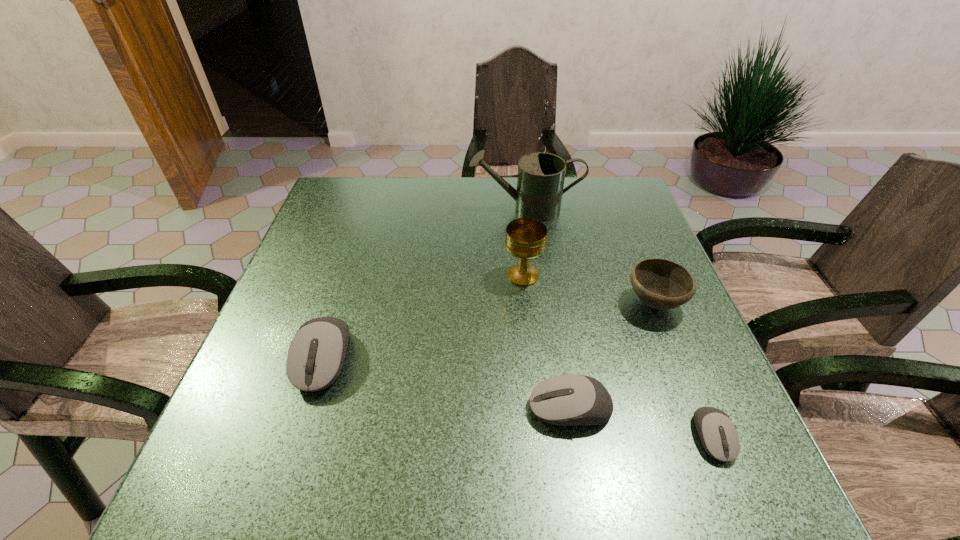
To achieve uniform spacing by inserting another mouse_(computer_equipment) among them, please point to a free space for this new mouse_(computer_equipment). Please provide its 2D coordinates. Your answer should be formatted as a tuple, i.e. [(x, y)], where the tuple contains the x and y coordinates of a point satisfying the conditions above.

[(441, 383)]